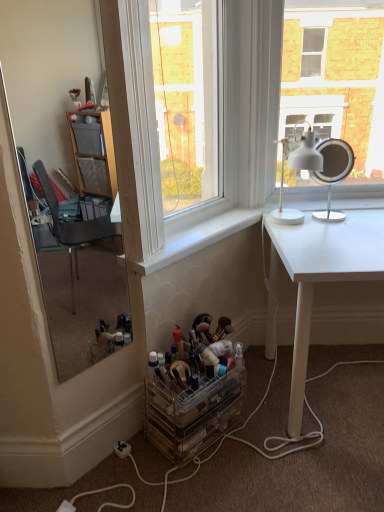
In order to click on free area in between white matte desk at right and clear acrylic makeup organizer at lower center in this screenshot , I will do `click(264, 438)`.